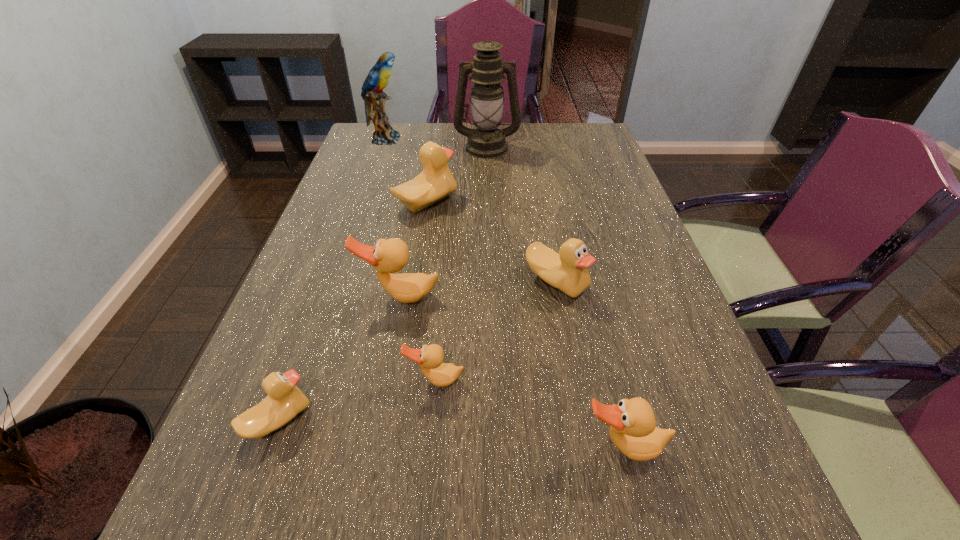
The image size is (960, 540). Identify the location of free region at the far right corner of the desktop. (584, 153).

What are the coordinates of `empty space between the rightmost tan duck and the smallest beige duck` in the screenshot? It's located at (450, 434).

Locate an element on the screen. The height and width of the screenshot is (540, 960). vacant area that lies between the farthest beige duck and the parrot is located at coordinates 406,171.

Image resolution: width=960 pixels, height=540 pixels. In order to click on vacant area between the second biggest tan duck and the second nearest beige duck in this screenshot , I will do `click(589, 364)`.

At what (x,y) coordinates should I click in order to perform the action: click on blank region between the leftmost duck and the second nearest tan duck. Please return your answer as a coordinate pair (x, y). The image size is (960, 540). Looking at the image, I should click on (357, 400).

Find the location of `vacant space in between the nearest beige duck and the second beige duck from right to left`. vacant space in between the nearest beige duck and the second beige duck from right to left is located at coordinates (352, 311).

Where is `free space that is in between the second nearest beige duck and the biggest beige duck`? The width and height of the screenshot is (960, 540). free space that is in between the second nearest beige duck and the biggest beige duck is located at coordinates (492, 242).

The height and width of the screenshot is (540, 960). I want to click on free space between the smallest tan duck and the parrot, so click(x=410, y=260).

Image resolution: width=960 pixels, height=540 pixels. I want to click on unoccupied position between the second beige duck from left to right and the oil lamp, so click(x=456, y=175).

Locate an element on the screen. Image resolution: width=960 pixels, height=540 pixels. vacant region between the farthest beige duck and the nearest beige duck is located at coordinates (352, 311).